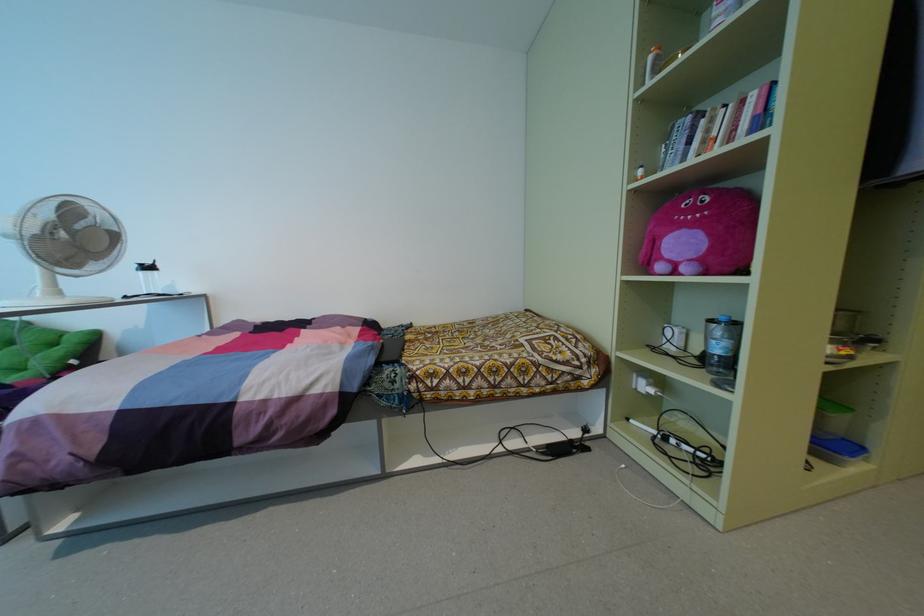
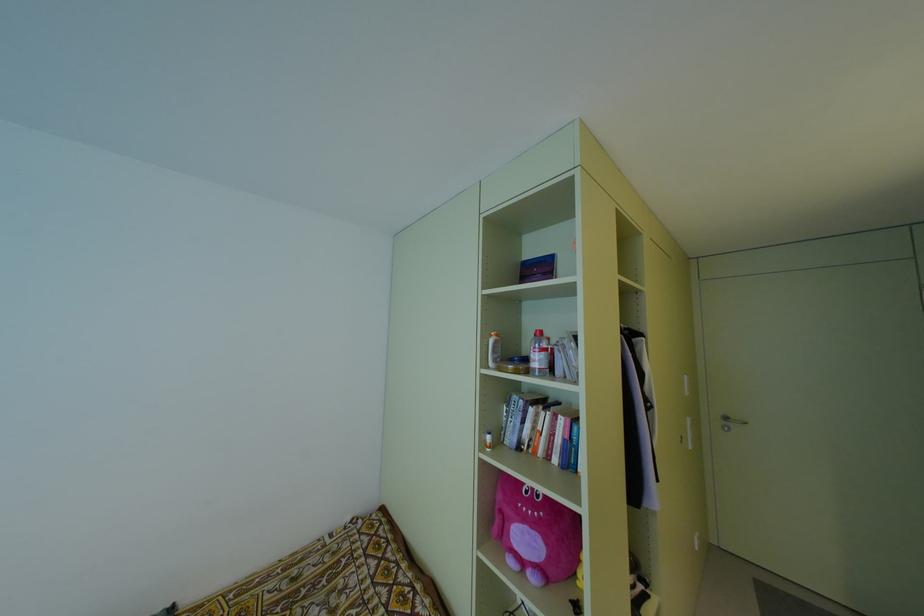
Question: The camera is either moving clockwise (left) or counter-clockwise (right) around the object. The first image is from the beginning of the video and the second image is from the end. Is the camera moving left or right when shooting the video?

Choices:
 (A) Left
 (B) Right

Answer: (A)